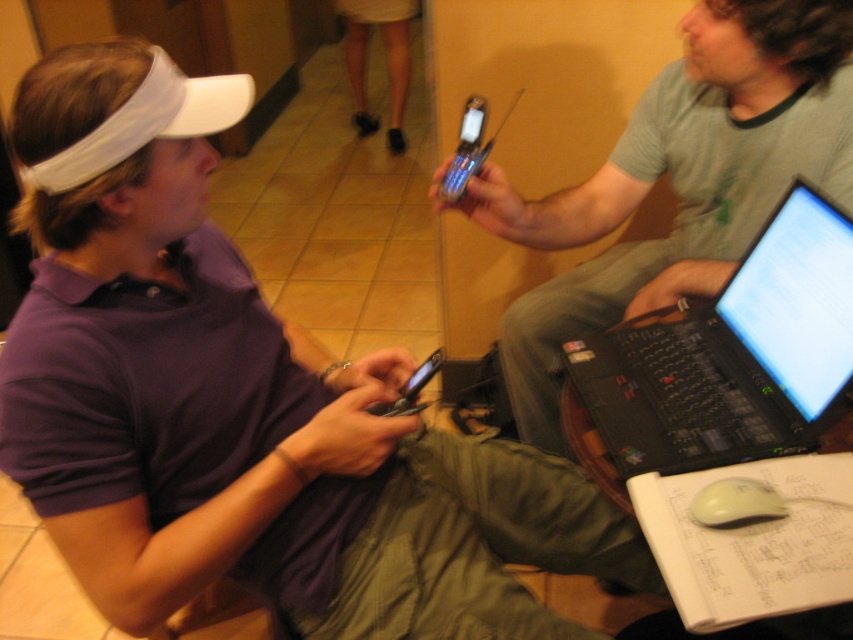
Does purple matte shirt at center appear over silver metallic phone at center?

No.

Is purple matte shirt at center positioned before silver metallic phone at center?

That is True.

Does point (154, 432) lie in front of point (448, 177)?

That is True.

In order to click on purple matte shirt at center in this screenshot , I will do click(x=259, y=442).

Consider the image. Which is below, purple matte shirt at center or matte black laptop at center?

Positioned lower is purple matte shirt at center.

Identify the location of purple matte shirt at center. (259, 442).

Identify the location of purple matte shirt at center. (259, 442).

Can you confirm if white matte mouse at lower right is positioned below black glossy smartphone at center?

Yes, white matte mouse at lower right is below black glossy smartphone at center.

Looking at this image, is the position of white matte mouse at lower right more distant than that of black glossy smartphone at center?

No, white matte mouse at lower right is closer to the viewer.

Does point (705, 496) come in front of point (415, 387)?

Yes, it is.

Locate an element on the screen. The image size is (853, 640). white matte mouse at lower right is located at coordinates (735, 502).